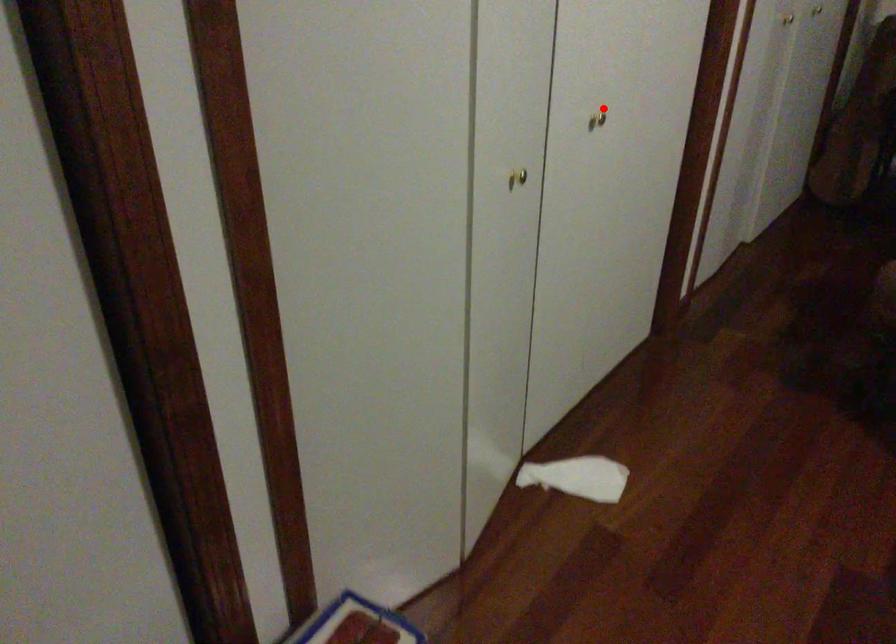
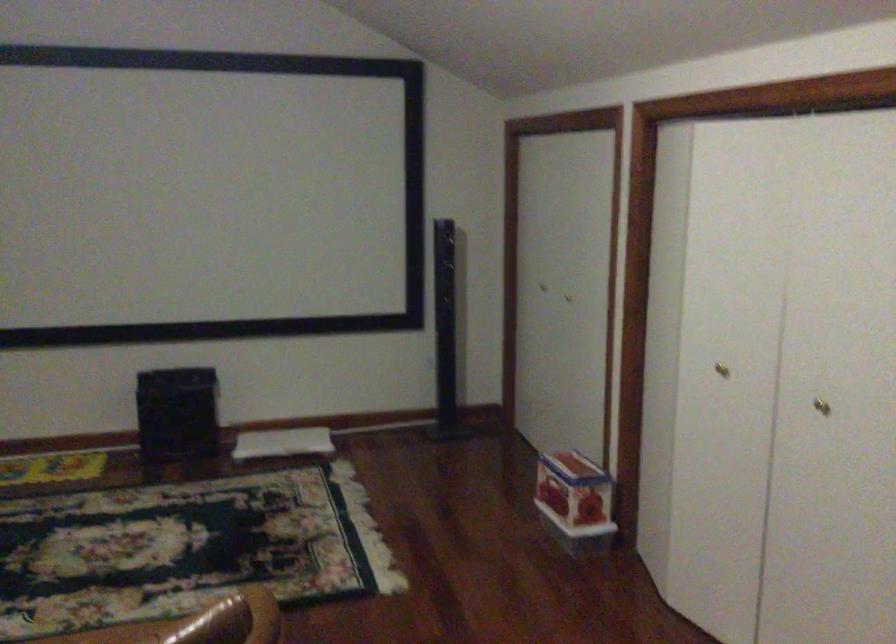
Locate, in the second image, the point that corresponds to the highlighted location in the first image.

(821, 406)